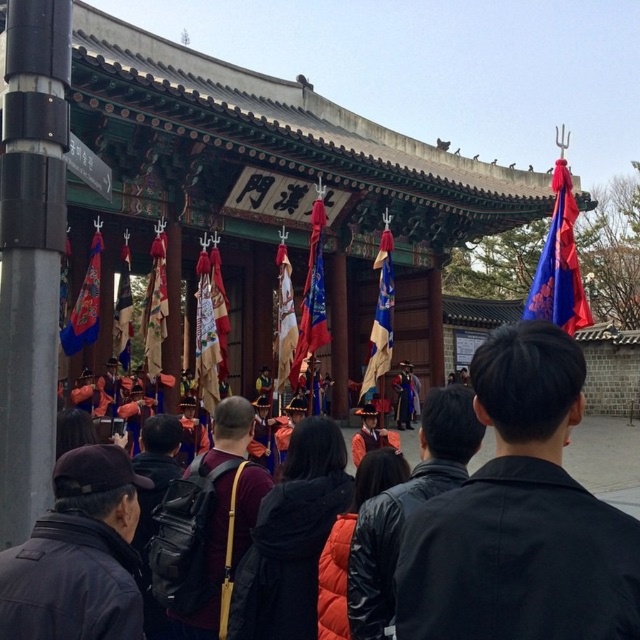
Question: From the image, what is the correct spatial relationship of dark gray jacket at lower left in relation to orange leather jacket at center?

Choices:
 (A) right
 (B) left

Answer: (B)

Question: Is dark brown leather backpack at center to the left of blue silk flag at left from the viewer's perspective?

Choices:
 (A) no
 (B) yes

Answer: (A)

Question: Which point is closer to the camera?

Choices:
 (A) red silk flag at center
 (B) dark brown leather backpack at center
 (C) dark gray jacket at lower left

Answer: (C)

Question: Does black leather jacket at center lie in front of silk flag at center?

Choices:
 (A) no
 (B) yes

Answer: (B)

Question: Among these points, which one is farthest from the camera?

Choices:
 (A) (90, 323)
 (B) (349, 609)
 (C) (160, 289)
 (D) (120, 291)

Answer: (D)

Question: Among these objects, which one is nearest to the camera?

Choices:
 (A) red silk flag at center
 (B) dark brown leather backpack at center
 (C) blue silk flag at upper right

Answer: (B)